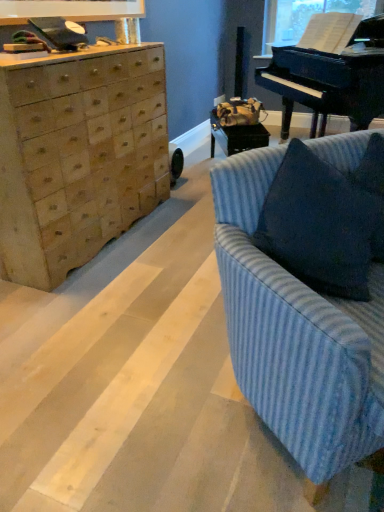
Question: Does black polished piano at upper right lie behind transparent plastic window screen at upper right?

Choices:
 (A) no
 (B) yes

Answer: (A)

Question: Considering the relative sizes of black polished piano at upper right and transparent plastic window screen at upper right in the image provided, is black polished piano at upper right taller than transparent plastic window screen at upper right?

Choices:
 (A) yes
 (B) no

Answer: (A)

Question: Are black polished piano at upper right and transparent plastic window screen at upper right located far from each other?

Choices:
 (A) no
 (B) yes

Answer: (A)

Question: Is black polished piano at upper right positioned in front of transparent plastic window screen at upper right?

Choices:
 (A) no
 (B) yes

Answer: (B)

Question: Is the surface of black polished piano at upper right in direct contact with transparent plastic window screen at upper right?

Choices:
 (A) no
 (B) yes

Answer: (A)

Question: From a real-world perspective, is black polished piano at upper right on transparent plastic window screen at upper right?

Choices:
 (A) no
 (B) yes

Answer: (A)

Question: Is blue striped fabric couch at right surrounded by black polished piano at upper right?

Choices:
 (A) no
 (B) yes

Answer: (A)

Question: Does black polished piano at upper right have a smaller size compared to blue striped fabric couch at right?

Choices:
 (A) no
 (B) yes

Answer: (A)

Question: From the image's perspective, would you say black polished piano at upper right is shown under blue striped fabric couch at right?

Choices:
 (A) yes
 (B) no

Answer: (B)

Question: Can you see black polished piano at upper right touching blue striped fabric couch at right?

Choices:
 (A) no
 (B) yes

Answer: (A)

Question: Does black polished piano at upper right have a lesser height compared to blue striped fabric couch at right?

Choices:
 (A) no
 (B) yes

Answer: (A)

Question: Considering the relative sizes of black polished piano at upper right and blue striped fabric couch at right in the image provided, is black polished piano at upper right bigger than blue striped fabric couch at right?

Choices:
 (A) yes
 (B) no

Answer: (A)

Question: Is blue textured pillow at right facing away from transparent plastic window screen at upper right?

Choices:
 (A) yes
 (B) no

Answer: (B)